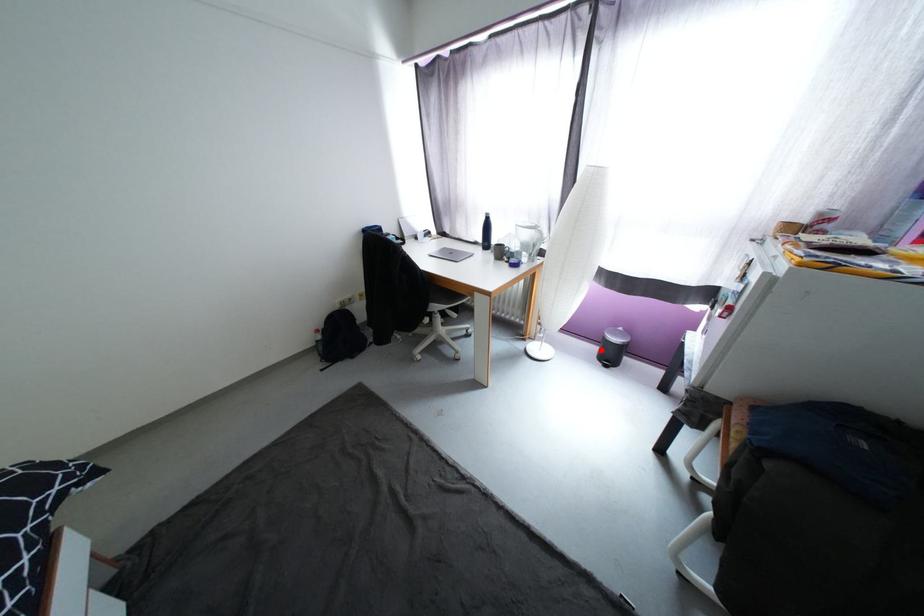
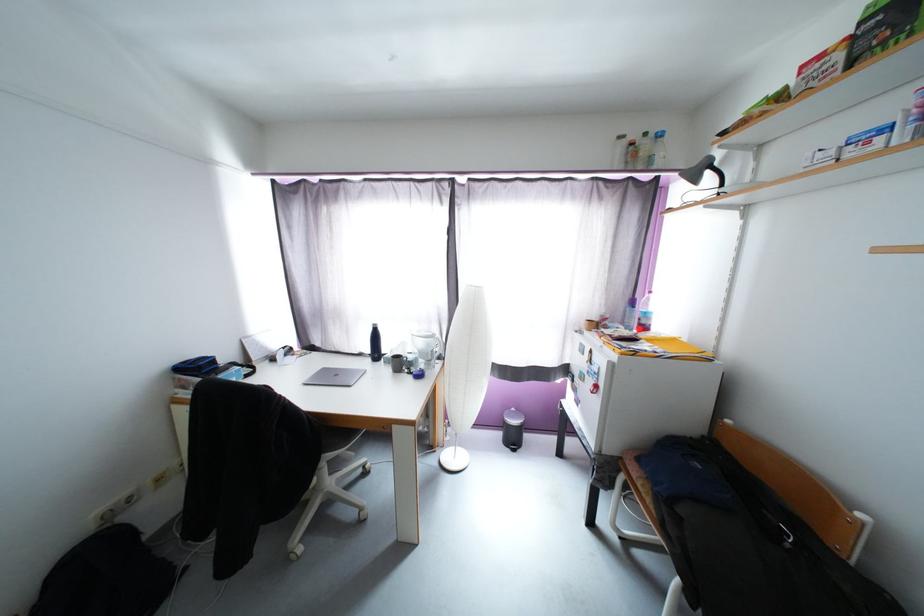
Where in the second image is the point corresponding to the highlighted location from the first image?

(505, 437)